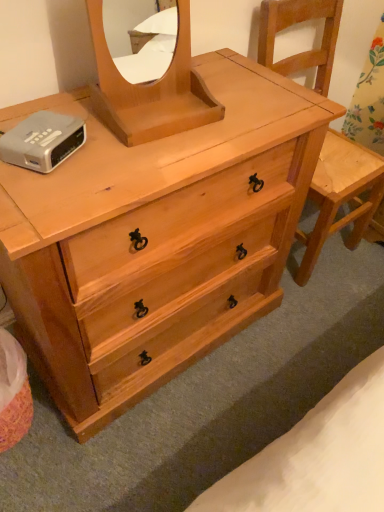
The height and width of the screenshot is (512, 384). What are the coordinates of `free space in front of silver metallic alarm clock at upper left` in the screenshot? It's located at (40, 201).